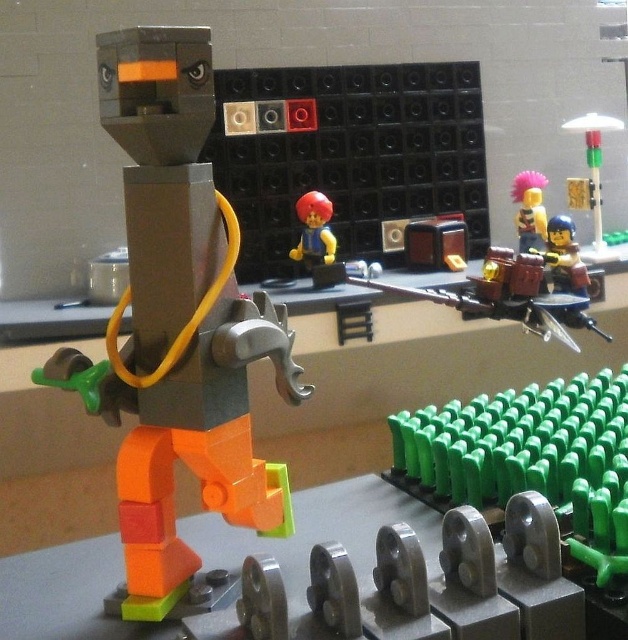
Is matte gray figure at center to the left of matte plastic minifigure at upper right from the viewer's perspective?

Correct, you'll find matte gray figure at center to the left of matte plastic minifigure at upper right.

Who is positioned more to the right, matte gray figure at center or matte plastic minifigure at upper right?

matte plastic minifigure at upper right

This screenshot has width=628, height=640. I want to click on matte gray figure at center, so click(176, 323).

Can you confirm if brick-like yellow figure at center is smaller than matte plastic minifigure at upper right?

Correct, brick-like yellow figure at center occupies less space than matte plastic minifigure at upper right.

Can you confirm if brick-like yellow figure at center is positioned to the right of matte plastic minifigure at upper right?

No, brick-like yellow figure at center is not to the right of matte plastic minifigure at upper right.

Identify the location of brick-like yellow figure at center. [x=315, y=230].

Does translucent green plastic traffic light at upper right have a greater width compared to shiny pink hair at upper right?

Correct, the width of translucent green plastic traffic light at upper right exceeds that of shiny pink hair at upper right.

Does point (593, 132) come in front of point (544, 232)?

No, it is not.

Does point (587, 205) lie behind point (538, 209)?

Yes, point (587, 205) is farther from viewer.

This screenshot has width=628, height=640. In order to click on translucent green plastic traffic light at upper right in this screenshot , I will do `click(590, 172)`.